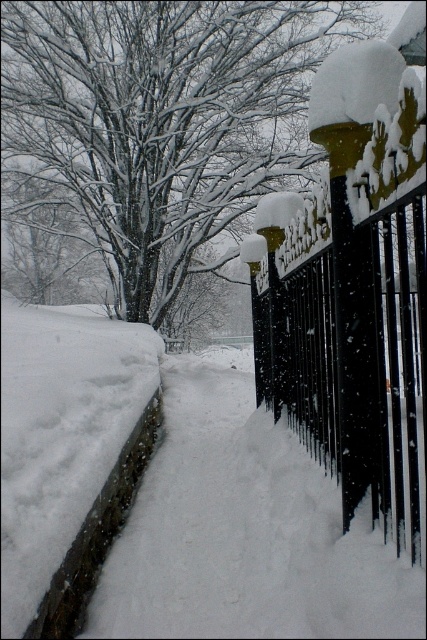
Question: Is snow-covered tree at upper left smaller than snow-covered wrought iron gate at right?

Choices:
 (A) yes
 (B) no

Answer: (A)

Question: Which of the following is the farthest from the observer?

Choices:
 (A) snow-covered tree at upper left
 (B) snow-covered wrought iron gate at right

Answer: (A)

Question: Which point is farther from the camera taking this photo?

Choices:
 (A) (400, 461)
 (B) (207, 109)

Answer: (B)

Question: Can you confirm if snow-covered tree at upper left is thinner than snow-covered wrought iron gate at right?

Choices:
 (A) yes
 (B) no

Answer: (A)

Question: Is snow-covered tree at upper left to the left of snow-covered wrought iron gate at right from the viewer's perspective?

Choices:
 (A) no
 (B) yes

Answer: (B)